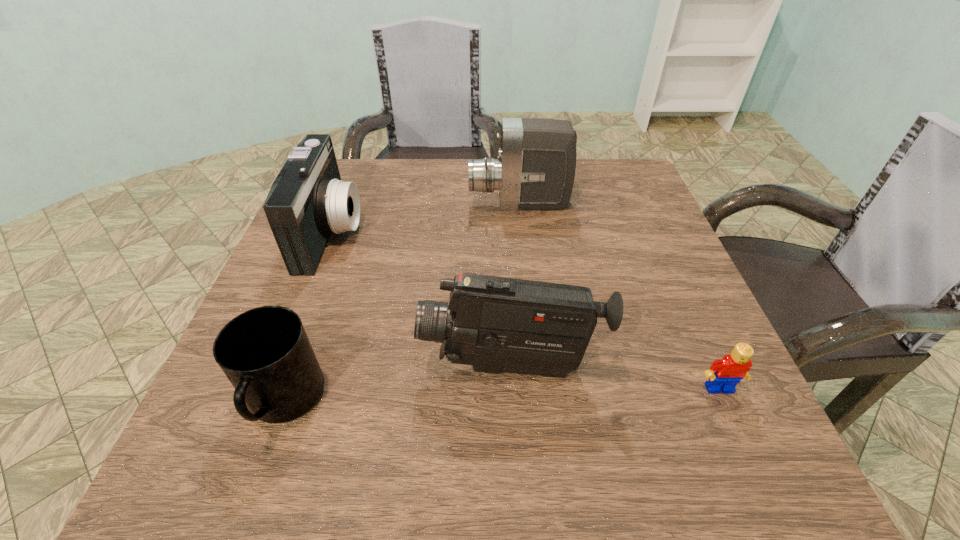
Find the location of `object that is at the near edge`. object that is at the near edge is located at coordinates (265, 353).

Locate an element on the screen. This screenshot has height=540, width=960. camcorder positioned at the left edge is located at coordinates (308, 201).

Locate an element on the screen. This screenshot has height=540, width=960. mug at the left edge is located at coordinates (265, 353).

You are a GUI agent. You are given a task and a screenshot of the screen. Output one action in this format:
    pyautogui.click(x=<x>, y=<y>)
    Task: Click on the object located at the right edge
    The image size is (960, 540).
    Given the screenshot: What is the action you would take?
    pyautogui.click(x=724, y=374)

Where is `object at the far left corner`? This screenshot has height=540, width=960. object at the far left corner is located at coordinates (308, 201).

Locate an element on the screen. This screenshot has height=540, width=960. object that is at the near left corner is located at coordinates (265, 353).

Find the location of a particular element. blank space at the far edge of the desktop is located at coordinates (442, 169).

In the image, there is a desktop. Where is `vacant area at the left edge`? vacant area at the left edge is located at coordinates (271, 291).

Locate an element on the screen. This screenshot has width=960, height=540. free space at the right edge of the desktop is located at coordinates (629, 222).

Image resolution: width=960 pixels, height=540 pixels. In the image, there is a desktop. What are the coordinates of `vacant space at the far left corner` in the screenshot? It's located at (343, 171).